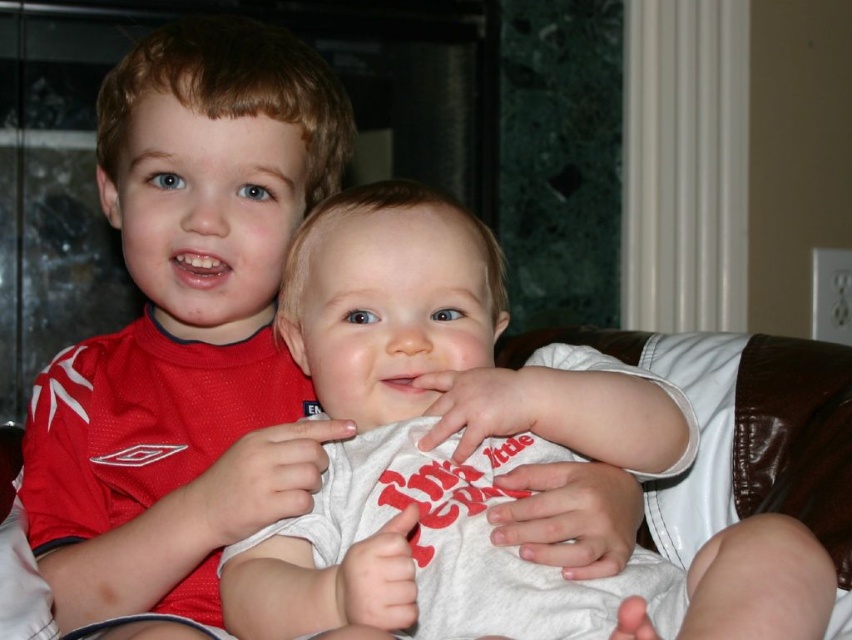
You are a photographer trying to capture a group photo of the white cotton shirt at center and the matte red shirt at upper left. The camera you are using has a minimum focusing distance of 12 centimeters. Can you take a clear photo of both shirts without moving them?

The white cotton shirt at center is 13.36 centimeters away from the matte red shirt at upper left. Since the distance between them is greater than the camera minimum focusing distance of 12 centimeters, the camera can focus on both shirts and take a clear photo without moving them.

You are a photographer setting up a shoot with two children. You need to adjust the camera height so both the white cotton shirt at center and the matte red shirt at upper left are fully visible in the frame. Which shirt should you position higher to ensure both are visible?

The matte red shirt at upper left is taller than the white cotton shirt at center, so positioning the matte red shirt at upper left higher will help ensure both shirts are visible in the frame.

You are a photographer setting up for a family photo. You have two shirts in the scene, a white cotton shirt at center and a matte red shirt at upper left. Which shirt takes up more visual space in the image?

The matte red shirt at upper left occupies more visual space in the image than the white cotton shirt at center.